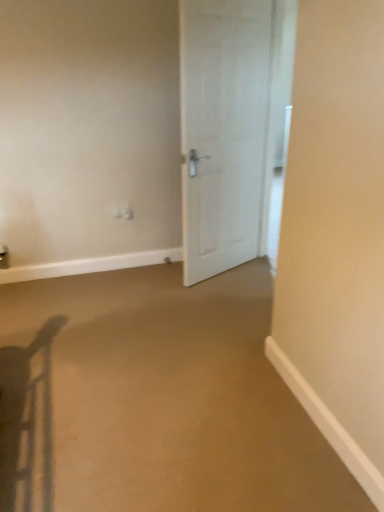
What are the coordinates of `white matte door at center` in the screenshot? It's located at (222, 130).

What do you see at coordinates (222, 130) in the screenshot? The width and height of the screenshot is (384, 512). I see `white matte door at center` at bounding box center [222, 130].

You are a GUI agent. You are given a task and a screenshot of the screen. Output one action in this format:
    pyautogui.click(x=<x>, y=<y>)
    Task: Click on the white matte door at center
    
    Given the screenshot: What is the action you would take?
    222,130